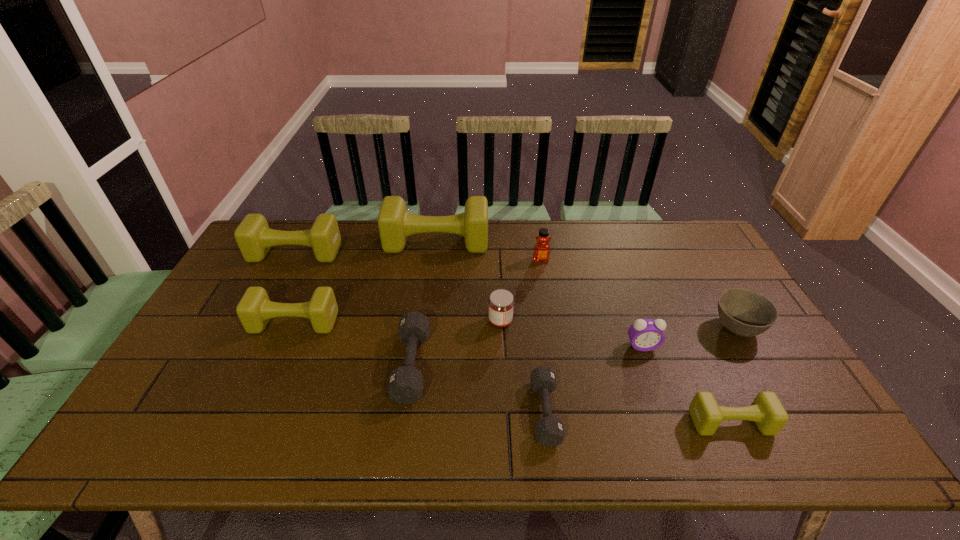
Locate an element on the screen. The width and height of the screenshot is (960, 540). vacant space at the near edge of the desktop is located at coordinates 373,438.

The image size is (960, 540). I want to click on vacant space at the left edge, so click(x=221, y=308).

In the image, there is a desktop. Where is `free space at the right edge`? The image size is (960, 540). free space at the right edge is located at coordinates (688, 280).

At what (x,y) coordinates should I click in order to perform the action: click on free spot at the far left corner of the desktop. Please return your answer as a coordinate pair (x, y). Looking at the image, I should click on (277, 247).

Find the location of a particular element. This screenshot has width=960, height=540. vacant space at the far right corner of the desktop is located at coordinates pos(669,244).

Identify the location of unoccupied area between the alarm clock and the honey. (591, 303).

The width and height of the screenshot is (960, 540). What are the coordinates of `free space that is in between the bowl and the honey` in the screenshot? It's located at (638, 294).

Locate an element on the screen. The height and width of the screenshot is (540, 960). vacant area between the left gray dumbbell and the honey is located at coordinates (476, 313).

Image resolution: width=960 pixels, height=540 pixels. What are the coordinates of `free area in between the bowl and the second tallest dumbbell` in the screenshot? It's located at (516, 291).

Identify the location of free spot between the tallest object and the smaller gray dumbbell. The height and width of the screenshot is (540, 960). (491, 327).